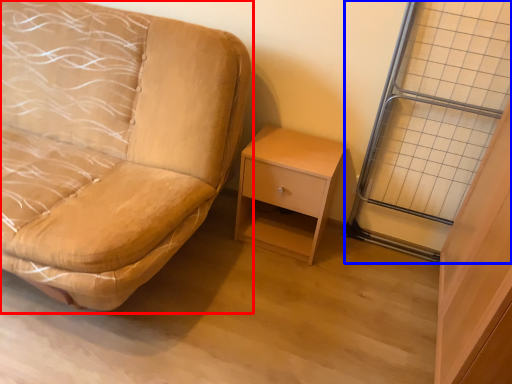
Question: Which point is closer to the camera, studio couch (highlighted by a red box) or glass door (highlighted by a blue box)?

Choices:
 (A) studio couch
 (B) glass door

Answer: (A)